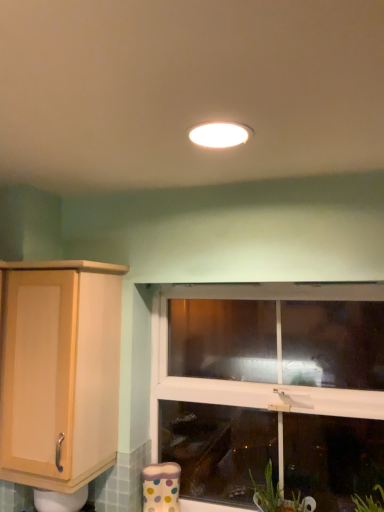
Question: From the image's perspective, is light wood cabinet at left located beneath clear glass window at center?

Choices:
 (A) yes
 (B) no

Answer: (B)

Question: Is light wood cabinet at left facing towards clear glass window at center?

Choices:
 (A) no
 (B) yes

Answer: (A)

Question: Is light wood cabinet at left completely or partially outside of clear glass window at center?

Choices:
 (A) no
 (B) yes

Answer: (B)

Question: Is light wood cabinet at left at the right side of clear glass window at center?

Choices:
 (A) no
 (B) yes

Answer: (A)

Question: Does light wood cabinet at left have a greater height compared to clear glass window at center?

Choices:
 (A) yes
 (B) no

Answer: (B)

Question: In terms of size, does light wood cabinet at left appear bigger or smaller than white glossy light fixture at center?

Choices:
 (A) small
 (B) big

Answer: (B)

Question: Is light wood cabinet at left inside the boundaries of white glossy light fixture at center, or outside?

Choices:
 (A) outside
 (B) inside

Answer: (A)

Question: Looking at their shapes, would you say light wood cabinet at left is wider or thinner than white glossy light fixture at center?

Choices:
 (A) wide
 (B) thin

Answer: (A)

Question: From the image's perspective, is light wood cabinet at left positioned above or below white glossy light fixture at center?

Choices:
 (A) below
 (B) above

Answer: (A)

Question: Is white glossy light fixture at center spatially inside clear glass window at center, or outside of it?

Choices:
 (A) inside
 (B) outside

Answer: (B)

Question: In the image, is white glossy light fixture at center on the left side or the right side of clear glass window at center?

Choices:
 (A) left
 (B) right

Answer: (A)

Question: From a real-world perspective, is white glossy light fixture at center above or below clear glass window at center?

Choices:
 (A) above
 (B) below

Answer: (A)

Question: Considering their positions, is white glossy light fixture at center located in front of or behind clear glass window at center?

Choices:
 (A) behind
 (B) front

Answer: (B)

Question: Visually, is light wood cabinet at left positioned to the left or to the right of clear glass window at center?

Choices:
 (A) right
 (B) left

Answer: (B)

Question: From the image's perspective, relative to clear glass window at center, is light wood cabinet at left above or below?

Choices:
 (A) above
 (B) below

Answer: (A)